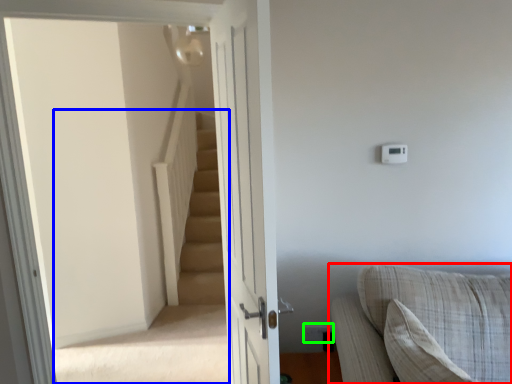
Question: Based on their relative distances, which object is farther from studio couch (highlighted by a red box)? Choose from stairwell (highlighted by a blue box) and electric outlet (highlighted by a green box).

Choices:
 (A) stairwell
 (B) electric outlet

Answer: (A)